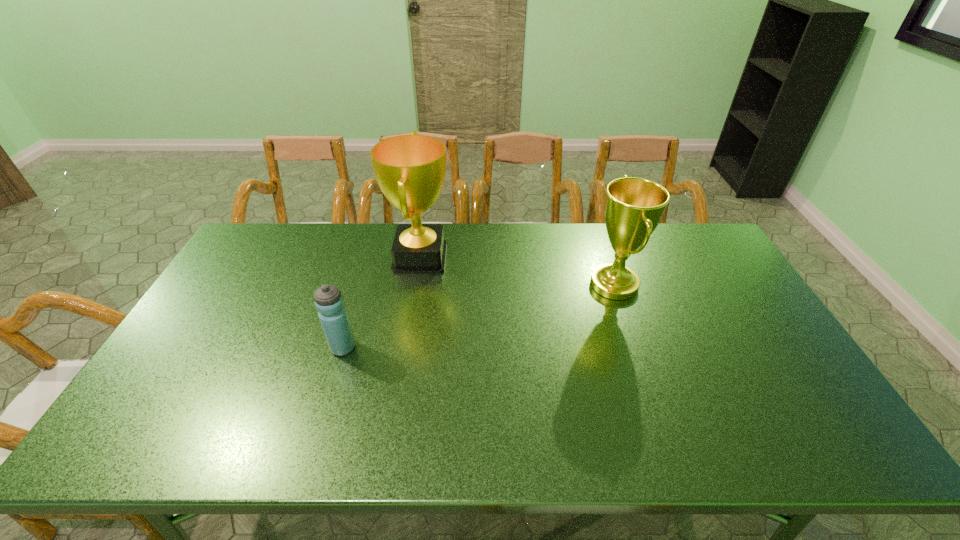
The image size is (960, 540). Identify the location of vacant space at the far edge. (345, 238).

The height and width of the screenshot is (540, 960). In order to click on free space at the near edge of the desktop in this screenshot , I will do `click(299, 422)`.

The image size is (960, 540). In order to click on free space at the left edge in this screenshot , I will do `click(191, 334)`.

Where is `vacant space at the right edge of the desktop`? vacant space at the right edge of the desktop is located at coordinates (702, 293).

The height and width of the screenshot is (540, 960). Identify the location of vacant point at the far right corner. (694, 255).

You are a GUI agent. You are given a task and a screenshot of the screen. Output one action in this format:
    pyautogui.click(x=<x>, y=<y>)
    Task: Click on the empty space between the shorter award and the left award
    This screenshot has height=540, width=960.
    Given the screenshot: What is the action you would take?
    pyautogui.click(x=517, y=271)

Locate an element on the screen. The height and width of the screenshot is (540, 960). free spot between the second object from left to right and the rightmost object is located at coordinates (517, 271).

Where is `vacant area between the second shortest object and the left award`? This screenshot has height=540, width=960. vacant area between the second shortest object and the left award is located at coordinates point(517,271).

Locate an element on the screen. The width and height of the screenshot is (960, 540). unoccupied area between the rightmost object and the nearest object is located at coordinates (478, 316).

This screenshot has height=540, width=960. What are the coordinates of `free space between the shorter award and the leftmost object` in the screenshot? It's located at point(478,316).